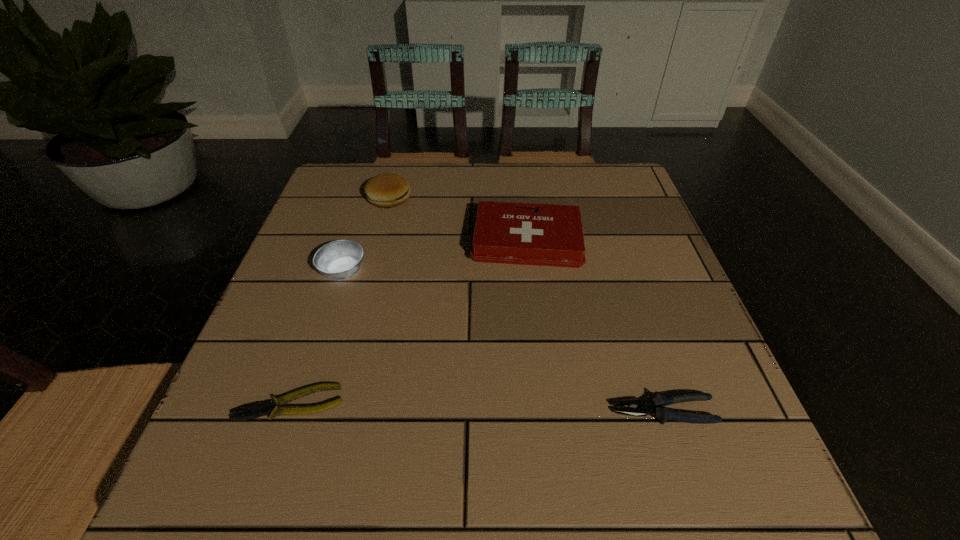
At what (x,y) coordinates should I click in order to perform the action: click on object that is at the far left corner. Please return your answer as a coordinate pair (x, y). Looking at the image, I should click on (387, 190).

Where is `vacant space at the far edge of the desktop`? The image size is (960, 540). vacant space at the far edge of the desktop is located at coordinates (524, 165).

This screenshot has width=960, height=540. In the image, there is a desktop. In order to click on free space at the near edge in this screenshot , I will do `click(372, 485)`.

In the image, there is a desktop. Where is `vacant space at the left edge`? vacant space at the left edge is located at coordinates (321, 222).

At what (x,y) coordinates should I click in order to perform the action: click on free space at the right edge of the desktop. Please return your answer as a coordinate pair (x, y). The width and height of the screenshot is (960, 540). Looking at the image, I should click on click(x=703, y=376).

This screenshot has height=540, width=960. Identify the location of vacant space at the near left corner of the desktop. (219, 482).

In the image, there is a desktop. In order to click on vacant space at the far right corner in this screenshot , I will do `click(590, 213)`.

Image resolution: width=960 pixels, height=540 pixels. Identify the location of empty space that is in between the farthest object and the taller pliers. (526, 305).

I want to click on unoccupied area between the farthest object and the first-aid kit, so click(458, 219).

Locate an element on the screen. free spot between the shorter pliers and the patty is located at coordinates [x=340, y=301].